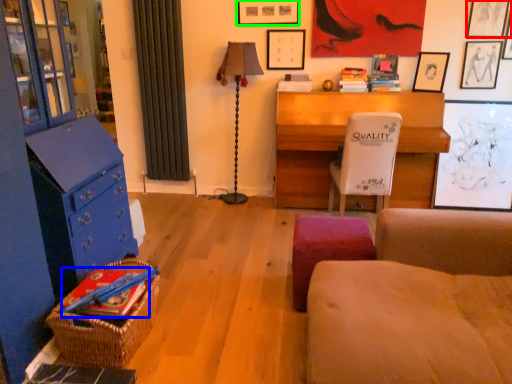
Question: Which is farther away from picture frame (highlighted by a red box)? book (highlighted by a blue box) or picture frame (highlighted by a green box)?

Choices:
 (A) book
 (B) picture frame

Answer: (A)